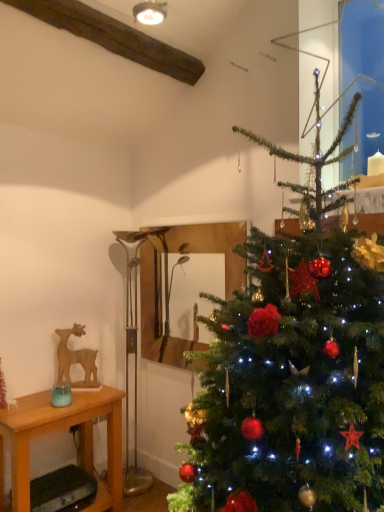
Question: Considering the relative sizes of wooden table at left and wooden deer at left in the image provided, is wooden table at left thinner than wooden deer at left?

Choices:
 (A) yes
 (B) no

Answer: (B)

Question: From the image's perspective, is wooden table at left beneath wooden deer at left?

Choices:
 (A) yes
 (B) no

Answer: (A)

Question: Does wooden table at left appear on the right side of wooden deer at left?

Choices:
 (A) no
 (B) yes

Answer: (A)

Question: Is wooden table at left bigger than wooden deer at left?

Choices:
 (A) no
 (B) yes

Answer: (B)

Question: Is wooden table at left not near wooden deer at left?

Choices:
 (A) yes
 (B) no

Answer: (B)

Question: Do you think wooden mirror at center is within green matte christmas tree at right, or outside of it?

Choices:
 (A) outside
 (B) inside

Answer: (A)

Question: In terms of width, does wooden mirror at center look wider or thinner when compared to green matte christmas tree at right?

Choices:
 (A) thin
 (B) wide

Answer: (A)

Question: From a real-world perspective, is wooden mirror at center positioned above or below green matte christmas tree at right?

Choices:
 (A) below
 (B) above

Answer: (B)

Question: In the image, is wooden mirror at center positioned in front of or behind green matte christmas tree at right?

Choices:
 (A) front
 (B) behind

Answer: (B)

Question: Is green matte christmas tree at right situated inside wooden mirror at center or outside?

Choices:
 (A) inside
 (B) outside

Answer: (B)

Question: Considering the positions of point (382, 421) and point (165, 334), is point (382, 421) closer or farther from the camera than point (165, 334)?

Choices:
 (A) closer
 (B) farther

Answer: (A)

Question: In terms of width, does green matte christmas tree at right look wider or thinner when compared to wooden mirror at center?

Choices:
 (A) thin
 (B) wide

Answer: (B)

Question: In terms of size, does green matte christmas tree at right appear bigger or smaller than wooden mirror at center?

Choices:
 (A) big
 (B) small

Answer: (A)

Question: Is point (344, 382) closer or farther from the camera than point (82, 393)?

Choices:
 (A) closer
 (B) farther

Answer: (A)

Question: Based on their sizes in the image, would you say green matte christmas tree at right is bigger or smaller than wooden table at left?

Choices:
 (A) small
 (B) big

Answer: (B)